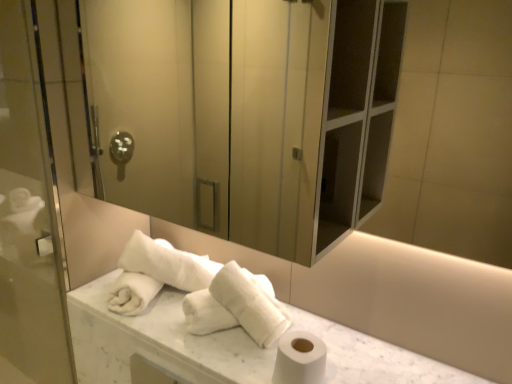
Question: From the image's perspective, is white marble counter top at center over transparent glass screen door at left, which is the second screen door in right-to-left order?

Choices:
 (A) yes
 (B) no

Answer: (B)

Question: Is white marble counter top at center further to the viewer compared to transparent glass screen door at left, which is the second screen door in right-to-left order?

Choices:
 (A) yes
 (B) no

Answer: (B)

Question: Would you say white marble counter top at center contains transparent glass screen door at left, which is the second screen door in right-to-left order?

Choices:
 (A) no
 (B) yes

Answer: (A)

Question: From a real-world perspective, is white marble counter top at center below transparent glass screen door at left, which is the second screen door in right-to-left order?

Choices:
 (A) yes
 (B) no

Answer: (A)

Question: Does white marble counter top at center have a greater height compared to transparent glass screen door at left, acting as the first screen door starting from the left?

Choices:
 (A) yes
 (B) no

Answer: (B)

Question: Relative to white matte toilet paper at lower right, is white fluffy towels at center, the 2th bath towel in the left-to-right sequence, in front or behind?

Choices:
 (A) front
 (B) behind

Answer: (B)

Question: Based on their positions, is white fluffy towels at center, the 2th bath towel in the left-to-right sequence, located to the left or right of white matte toilet paper at lower right?

Choices:
 (A) right
 (B) left

Answer: (B)

Question: Looking at the image, does white fluffy towels at center, which appears as the first bath towel when viewed from the right, seem bigger or smaller compared to white matte toilet paper at lower right?

Choices:
 (A) small
 (B) big

Answer: (B)

Question: Is white fluffy towels at center, which appears as the first bath towel when viewed from the right, taller or shorter than white matte toilet paper at lower right?

Choices:
 (A) short
 (B) tall

Answer: (B)

Question: From a real-world perspective, is white marble counter top at center physically located above or below white soft towel at center, which ranks as the 1th bath towel in left-to-right order?

Choices:
 (A) below
 (B) above

Answer: (A)

Question: From the image's perspective, relative to white soft towel at center, the second bath towel from the right, is white marble counter top at center above or below?

Choices:
 (A) above
 (B) below

Answer: (B)

Question: Looking at the image, does white marble counter top at center seem bigger or smaller compared to white soft towel at center, which ranks as the 1th bath towel in left-to-right order?

Choices:
 (A) small
 (B) big

Answer: (B)

Question: Would you say white marble counter top at center is inside or outside white soft towel at center, which ranks as the 1th bath towel in left-to-right order?

Choices:
 (A) outside
 (B) inside

Answer: (A)

Question: From the image's perspective, is white matte toilet paper at lower right above or below white soft towel at center, which ranks as the 1th bath towel in left-to-right order?

Choices:
 (A) above
 (B) below

Answer: (B)

Question: Visually, is white matte toilet paper at lower right positioned to the left or to the right of white soft towel at center, which ranks as the 1th bath towel in left-to-right order?

Choices:
 (A) left
 (B) right

Answer: (B)